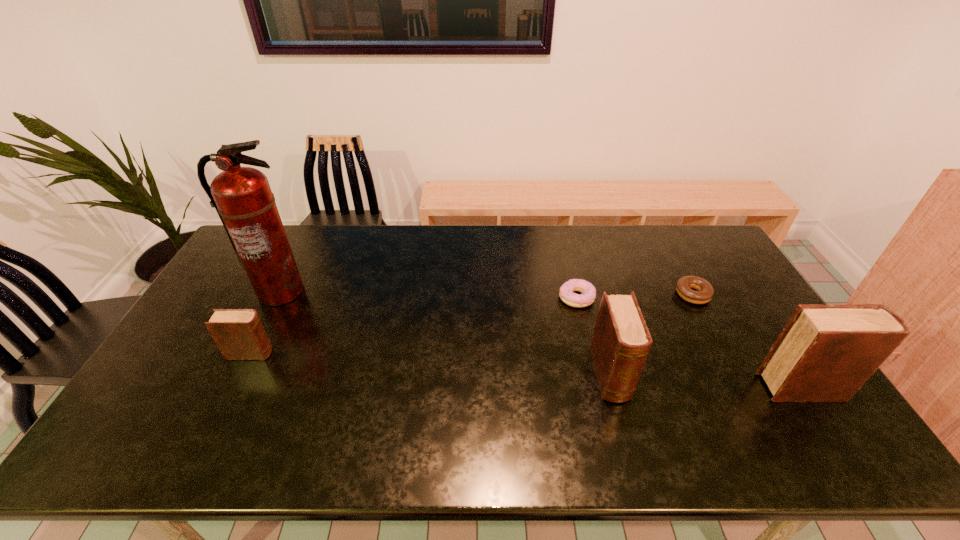
This screenshot has height=540, width=960. What are the coordinates of `vacant space located on the right of the left doughnut` in the screenshot? It's located at (666, 298).

You are a GUI agent. You are given a task and a screenshot of the screen. Output one action in this format:
    pyautogui.click(x=<x>, y=<y>)
    Task: Click on the vacant space located on the side of the fire extinguisher with the handle and hose
    The image size is (960, 540).
    Given the screenshot: What is the action you would take?
    pyautogui.click(x=218, y=416)

The image size is (960, 540). I want to click on object at the left edge, so click(242, 197).

Find the location of a particular element. diary that is at the right edge is located at coordinates (825, 353).

Find the location of a particular element. doughnut present at the right edge is located at coordinates tap(705, 292).

Where is `object that is at the near right corner`? object that is at the near right corner is located at coordinates (825, 353).

The height and width of the screenshot is (540, 960). In the image, there is a desktop. What are the coordinates of `free space at the far edge` in the screenshot? It's located at (426, 236).

You are a GUI agent. You are given a task and a screenshot of the screen. Output one action in this format:
    pyautogui.click(x=<x>, y=<y>)
    Task: Click on the vacant space at the near edge of the desktop
    
    Given the screenshot: What is the action you would take?
    pyautogui.click(x=378, y=408)

Find the location of a particular element. vacant region at the left edge is located at coordinates (167, 386).

At what (x,y) coordinates should I click in order to perform the action: click on vacant space at the right edge. Please return your answer as a coordinate pair (x, y). Looking at the image, I should click on (750, 316).